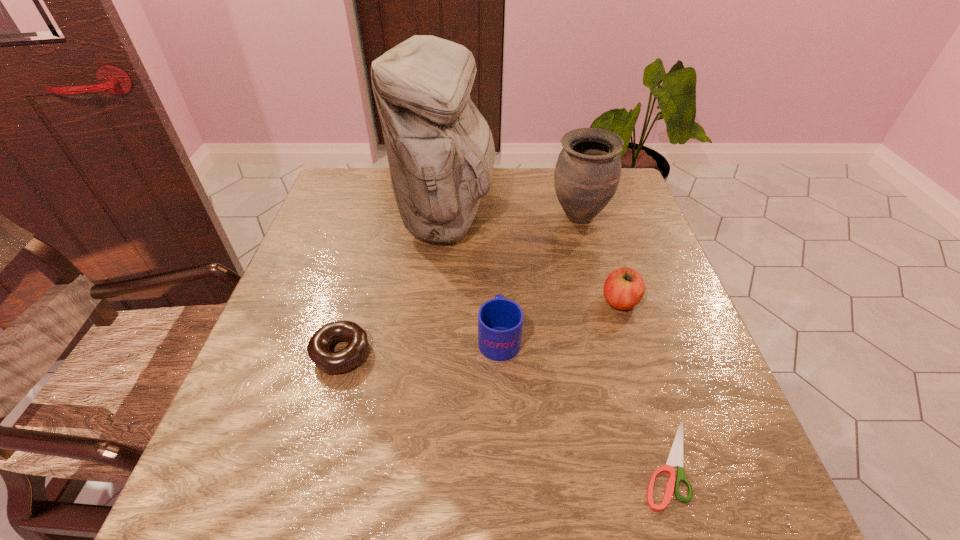
The height and width of the screenshot is (540, 960). Identify the location of apple situated at the right edge. click(x=624, y=288).

You are a GUI agent. You are given a task and a screenshot of the screen. Output one action in this format:
    pyautogui.click(x=<x>, y=<y>)
    Task: Click on the scissors that is positioned at the right edge
    The image size is (960, 540).
    Given the screenshot: What is the action you would take?
    pyautogui.click(x=675, y=458)

Find the location of `object present at the far right corner`. object present at the far right corner is located at coordinates (587, 173).

This screenshot has width=960, height=540. I want to click on object situated at the near right corner, so click(x=675, y=458).

Locate an element on the screen. Image resolution: width=960 pixels, height=540 pixels. free region at the far edge of the desktop is located at coordinates (386, 203).

This screenshot has height=540, width=960. In the image, there is a desktop. Identify the location of vacant space at the near edge. (314, 490).

At what (x,y) coordinates should I click in order to perform the action: click on free space at the left edge of the desktop. Please return your answer as a coordinate pair (x, y). The height and width of the screenshot is (540, 960). Looking at the image, I should click on (322, 267).

The height and width of the screenshot is (540, 960). I want to click on free space at the right edge, so click(x=640, y=230).

Find the location of a particular element. The image size is (960, 540). vacant space at the far left corner of the desktop is located at coordinates (345, 171).

I want to click on free space at the near left corner of the desktop, so click(x=253, y=511).